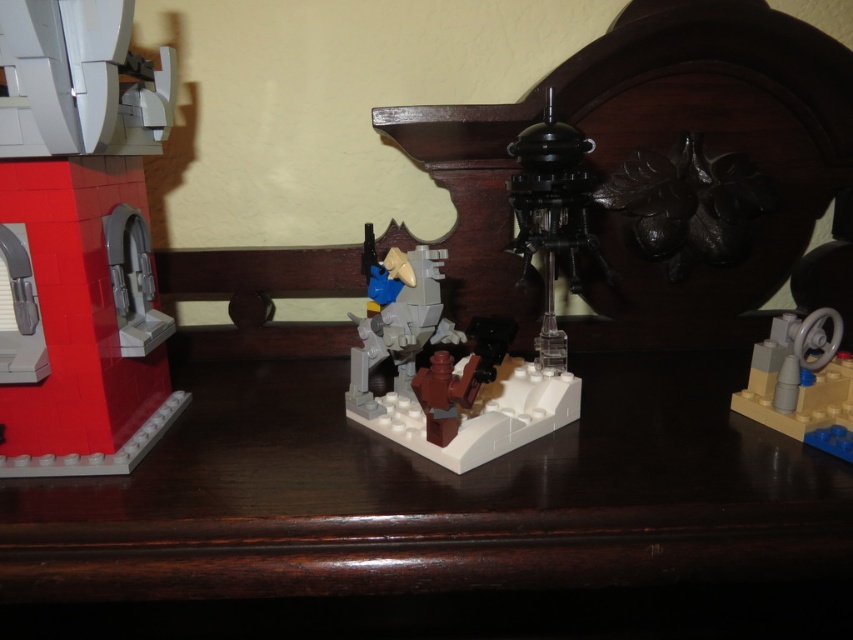
Question: Which of the following is the closest to the observer?

Choices:
 (A) (444, 449)
 (B) (566, 234)
 (C) (531, 458)

Answer: (A)

Question: Which of these objects is positioned closest to the dark wood table at center?

Choices:
 (A) matte gray plastic figure at center
 (B) black plastic/transparent plastic at center

Answer: (A)

Question: Which object appears closest to the camera in this image?

Choices:
 (A) smooth white tower at left
 (B) black plastic/transparent plastic at center
 (C) dark wood table at center

Answer: (A)

Question: Where is black plastic/transparent plastic at center located in relation to matte gray steering wheel at lower right in the image?

Choices:
 (A) above
 (B) below

Answer: (A)

Question: Is matte gray plastic figure at center thinner than matte gray steering wheel at lower right?

Choices:
 (A) yes
 (B) no

Answer: (B)

Question: Observing the image, what is the correct spatial positioning of black plastic/transparent plastic at center in reference to matte gray steering wheel at lower right?

Choices:
 (A) below
 (B) above

Answer: (B)